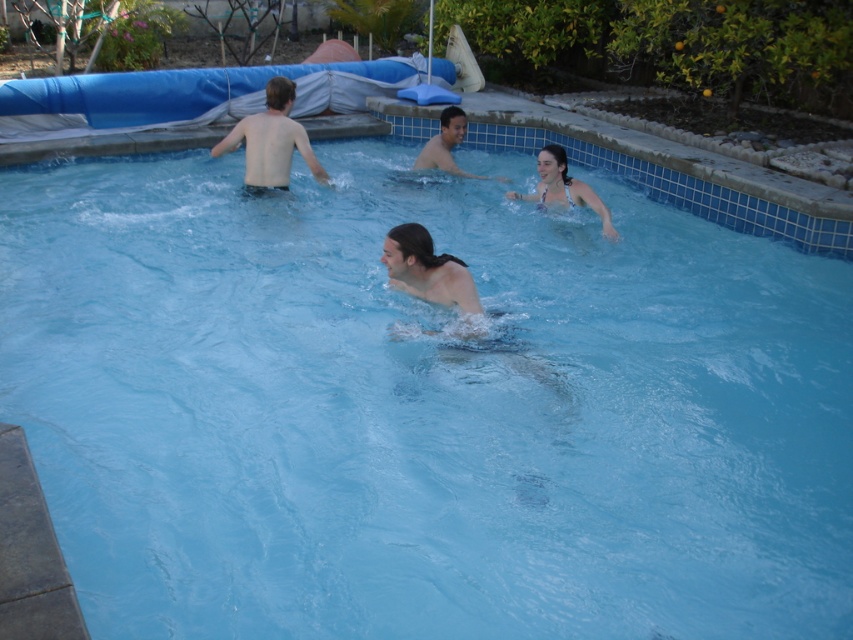
Between point (280, 148) and point (422, 154), which one is positioned in front?

Point (280, 148) is more forward.

Is smooth skin man at upper left further to the viewer compared to smooth skin man at center?

No, smooth skin man at upper left is closer to the viewer.

You are a GUI agent. You are given a task and a screenshot of the screen. Output one action in this format:
    pyautogui.click(x=<x>, y=<y>)
    Task: Click on the smooth skin man at upper left
    
    Given the screenshot: What is the action you would take?
    pyautogui.click(x=271, y=140)

How far apart are white bikini at center and smooth skin man at center?

white bikini at center is 1.21 meters from smooth skin man at center.

Describe the element at coordinates (563, 188) in the screenshot. The width and height of the screenshot is (853, 640). I see `white bikini at center` at that location.

The height and width of the screenshot is (640, 853). What are the coordinates of `white bikini at center` in the screenshot? It's located at (563, 188).

Can you confirm if smooth skin man at upper left is smaller than white bikini at center?

No, smooth skin man at upper left is not smaller than white bikini at center.

Identify the location of smooth skin man at upper left. The height and width of the screenshot is (640, 853). point(271,140).

The width and height of the screenshot is (853, 640). What do you see at coordinates (271, 140) in the screenshot? I see `smooth skin man at upper left` at bounding box center [271, 140].

Image resolution: width=853 pixels, height=640 pixels. Find the location of `smooth skin man at upper left`. smooth skin man at upper left is located at coordinates (271, 140).